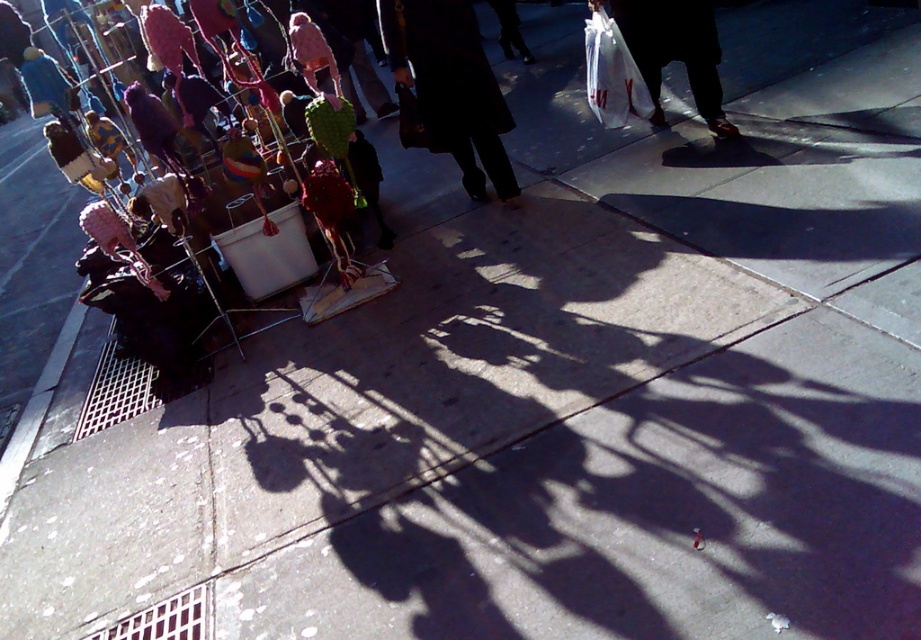
Question: From the image, what is the correct spatial relationship of dark matte coat at center in relation to white plastic bag at center?

Choices:
 (A) below
 (B) above

Answer: (A)

Question: Does dark matte coat at center have a smaller size compared to white plastic bag at center?

Choices:
 (A) yes
 (B) no

Answer: (B)

Question: Which point is farther to the camera?

Choices:
 (A) (490, 84)
 (B) (630, 3)

Answer: (B)

Question: Can you confirm if dark matte coat at center is positioned below white plastic bag at center?

Choices:
 (A) yes
 (B) no

Answer: (A)